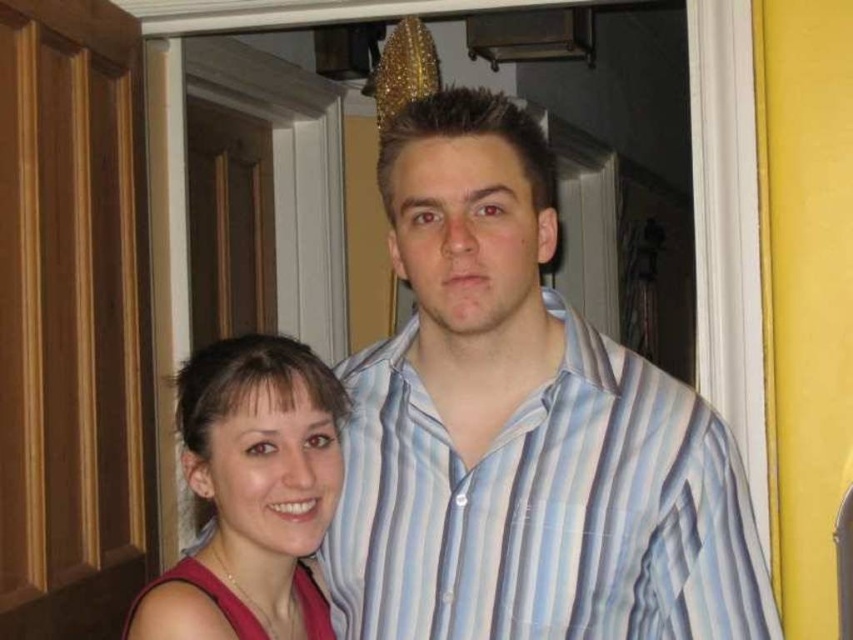
Is pink fabric dress at lower left further to camera compared to striped cotton shirt at center?

No, it is in front of striped cotton shirt at center.

Can you confirm if pink fabric dress at lower left is wider than striped cotton shirt at center?

Correct, the width of pink fabric dress at lower left exceeds that of striped cotton shirt at center.

Which is behind, point (599, 467) or point (577, 556)?

The point (599, 467) is behind.

You are a GUI agent. You are given a task and a screenshot of the screen. Output one action in this format:
    pyautogui.click(x=<x>, y=<y>)
    Task: Click on the pink fabric dress at lower left
    Image resolution: width=853 pixels, height=640 pixels.
    Given the screenshot: What is the action you would take?
    pyautogui.click(x=521, y=429)

Is pink fabric dress at lower left closer to camera compared to matte pink tank top at lower left?

No, pink fabric dress at lower left is further to the viewer.

Is point (439, 106) farther from viewer compared to point (223, 593)?

Yes.

You are a GUI agent. You are given a task and a screenshot of the screen. Output one action in this format:
    pyautogui.click(x=<x>, y=<y>)
    Task: Click on the pink fabric dress at lower left
    The height and width of the screenshot is (640, 853).
    Given the screenshot: What is the action you would take?
    pyautogui.click(x=521, y=429)

Is striped cotton shirt at center thinner than matte pink tank top at lower left?

In fact, striped cotton shirt at center might be wider than matte pink tank top at lower left.

Is striped cotton shirt at center below matte pink tank top at lower left?

Answer: No.

Does point (608, 340) come in front of point (154, 604)?

No.

Identify the location of striped cotton shirt at center. This screenshot has height=640, width=853. click(543, 508).